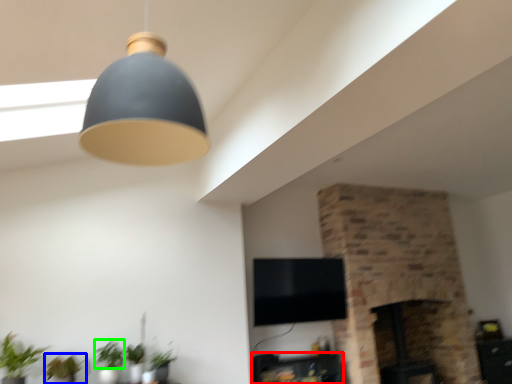
Question: Estimate the real-world distances between objects in this image. Which object is closer to furniture (highlighted by a red box), plant (highlighted by a blue box) or plant (highlighted by a green box)?

Choices:
 (A) plant
 (B) plant

Answer: (B)